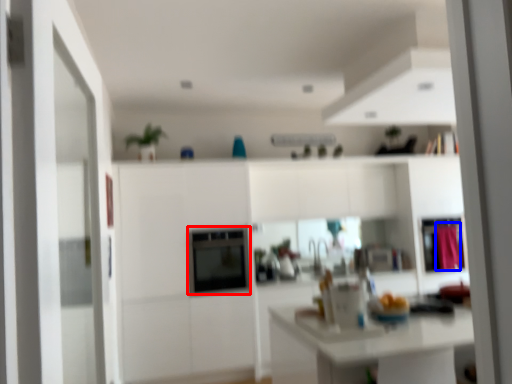
Question: Which of the following is the closest to the observer, appliance (highlighted by a red box) or curtain (highlighted by a blue box)?

Choices:
 (A) appliance
 (B) curtain

Answer: (A)